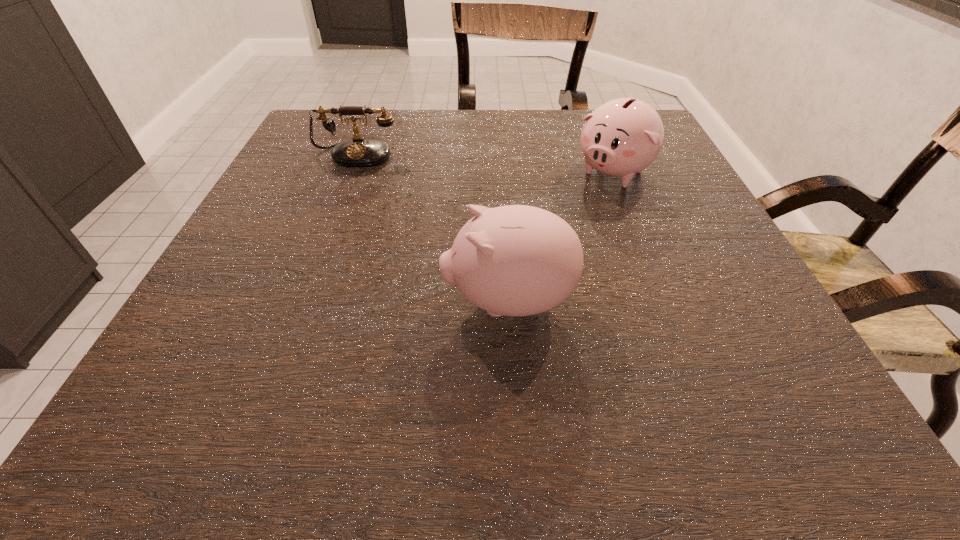
I want to click on free space located on the dial of the leftmost object, so click(347, 181).

Find the location of a particular element. The height and width of the screenshot is (540, 960). piggy bank positioned at the far edge is located at coordinates coord(622,137).

What are the coordinates of `telephone that is at the far edge` in the screenshot? It's located at (359, 152).

Identify the location of object that is at the left edge. (359, 152).

Locate an element on the screen. object that is at the right edge is located at coordinates (622, 137).

Locate an element on the screen. The image size is (960, 540). object that is positioned at the far left corner is located at coordinates (359, 152).

Find the location of a particular element. Image resolution: width=960 pixels, height=540 pixels. object that is at the far right corner is located at coordinates (622, 137).

At what (x,y) coordinates should I click in order to perform the action: click on free space at the far edge. Please return your answer as a coordinate pair (x, y). The height and width of the screenshot is (540, 960). Looking at the image, I should click on (453, 110).

Identify the location of free space at the left edge of the desktop. This screenshot has width=960, height=540. (258, 355).

Locate an element on the screen. This screenshot has height=540, width=960. vacant space at the right edge of the desktop is located at coordinates (722, 342).